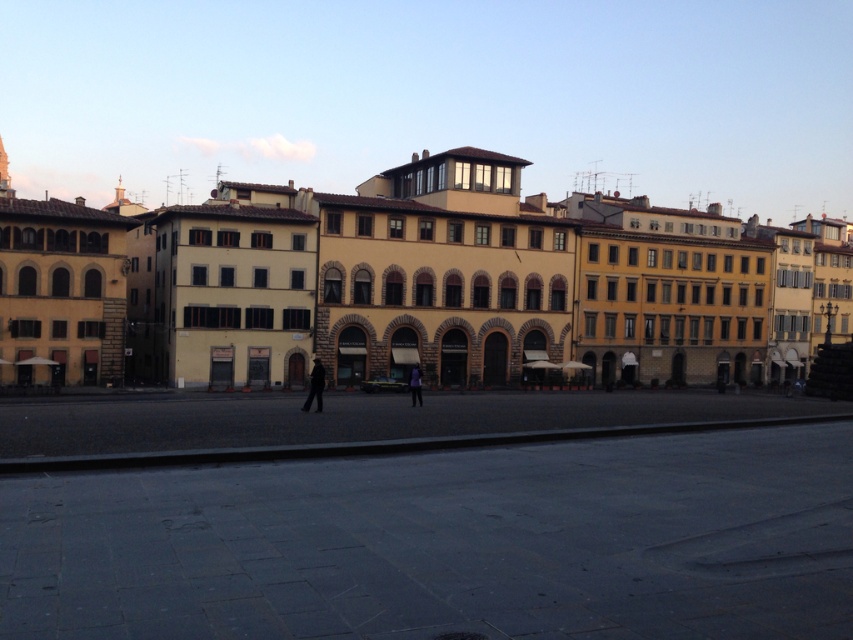
Question: Considering the real-world distances, which object is closest to the yellow stone building at center?

Choices:
 (A) purple fabric person at center
 (B) dark matte coat at center

Answer: (A)

Question: Can you confirm if yellow stone building at center is wider than purple fabric person at center?

Choices:
 (A) no
 (B) yes

Answer: (B)

Question: Which of the following is the farthest from the observer?

Choices:
 (A) (312, 388)
 (B) (189, 253)

Answer: (B)

Question: Which is nearer to the purple fabric person at center?

Choices:
 (A) dark matte coat at center
 (B) yellow stone building at center

Answer: (A)

Question: Where is dark matte coat at center located in relation to purple fabric person at center in the image?

Choices:
 (A) below
 (B) above

Answer: (B)

Question: Can you confirm if dark matte coat at center is wider than purple fabric person at center?

Choices:
 (A) no
 (B) yes

Answer: (B)